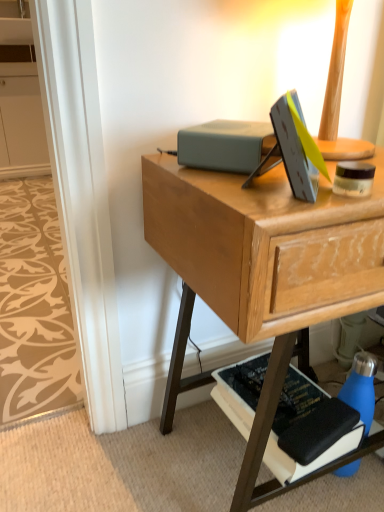
Question: Would you say matte gray book at center, which is counted as the first paperback book, starting from the top, is part of blue matte water bottle at lower right's contents?

Choices:
 (A) no
 (B) yes

Answer: (A)

Question: Considering the relative sizes of blue matte water bottle at lower right and matte gray book at center, positioned as the 2th paperback book in bottom-to-top order, in the image provided, is blue matte water bottle at lower right bigger than matte gray book at center, positioned as the 2th paperback book in bottom-to-top order,?

Choices:
 (A) no
 (B) yes

Answer: (B)

Question: Are blue matte water bottle at lower right and matte gray book at center, which is counted as the first paperback book, starting from the top, beside each other?

Choices:
 (A) no
 (B) yes

Answer: (A)

Question: From the image's perspective, is blue matte water bottle at lower right above matte gray book at center, which is counted as the first paperback book, starting from the top?

Choices:
 (A) no
 (B) yes

Answer: (A)

Question: From a real-world perspective, is blue matte water bottle at lower right located beneath matte gray book at center, positioned as the 2th paperback book in bottom-to-top order?

Choices:
 (A) yes
 (B) no

Answer: (A)

Question: Is white matte cabinet at upper left in front of or behind beige patterned carpet at lower left in the image?

Choices:
 (A) front
 (B) behind

Answer: (B)

Question: From a real-world perspective, is white matte cabinet at upper left positioned above or below beige patterned carpet at lower left?

Choices:
 (A) below
 (B) above

Answer: (B)

Question: Would you say white matte cabinet at upper left is inside or outside beige patterned carpet at lower left?

Choices:
 (A) inside
 (B) outside

Answer: (B)

Question: Considering the positions of white matte cabinet at upper left and beige patterned carpet at lower left in the image, is white matte cabinet at upper left taller or shorter than beige patterned carpet at lower left?

Choices:
 (A) short
 (B) tall

Answer: (B)

Question: Would you say black matte book at lower right, the second paperback book positioned from the top, is to the left or to the right of white matte cabinet at upper left in the picture?

Choices:
 (A) right
 (B) left

Answer: (A)

Question: Is point (238, 378) positioned closer to the camera than point (8, 45)?

Choices:
 (A) closer
 (B) farther

Answer: (A)

Question: Considering their positions, is black matte book at lower right, the second paperback book positioned from the top, located in front of or behind white matte cabinet at upper left?

Choices:
 (A) behind
 (B) front

Answer: (B)

Question: In terms of height, does black matte book at lower right, the second paperback book positioned from the top, look taller or shorter compared to white matte cabinet at upper left?

Choices:
 (A) short
 (B) tall

Answer: (A)

Question: Is point (374, 362) positioned closer to the camera than point (238, 139)?

Choices:
 (A) farther
 (B) closer

Answer: (A)

Question: Is blue matte water bottle at lower right wider or thinner than matte gray book at center, positioned as the 2th paperback book in bottom-to-top order?

Choices:
 (A) wide
 (B) thin

Answer: (B)